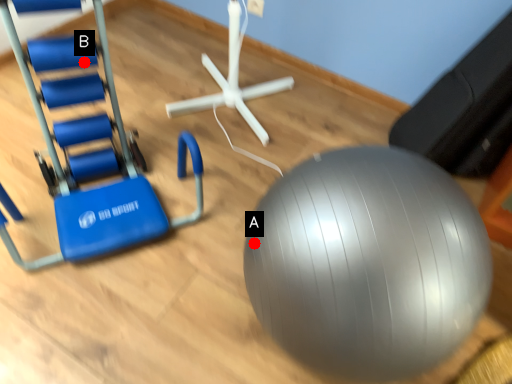
Question: Two points are circled on the image, labeled by A and B beside each circle. Which point is farther from the camera taking this photo?

Choices:
 (A) A is further
 (B) B is further

Answer: (B)